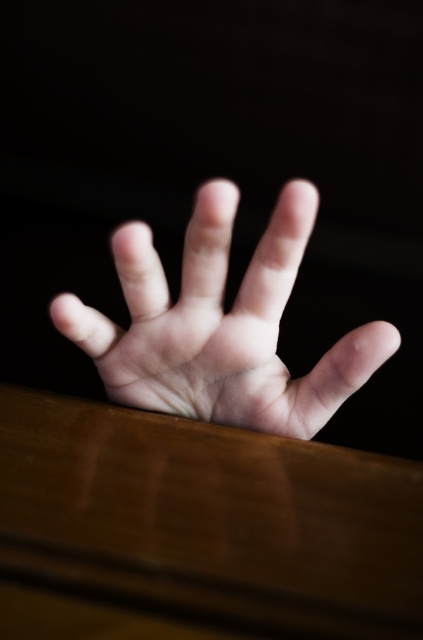
Between brown polished wood table at lower center and pale skin hand at center, which one has less height?

With less height is brown polished wood table at lower center.

The width and height of the screenshot is (423, 640). What are the coordinates of `brown polished wood table at lower center` in the screenshot? It's located at [x=209, y=518].

Locate an element on the screen. brown polished wood table at lower center is located at coordinates (209, 518).